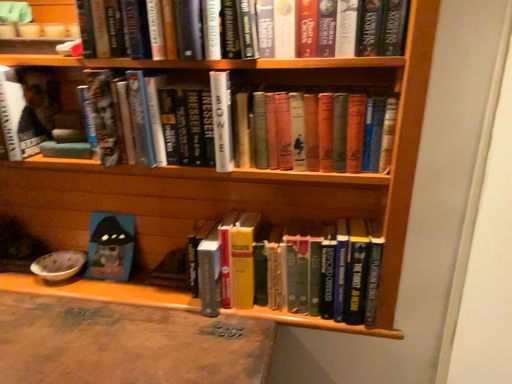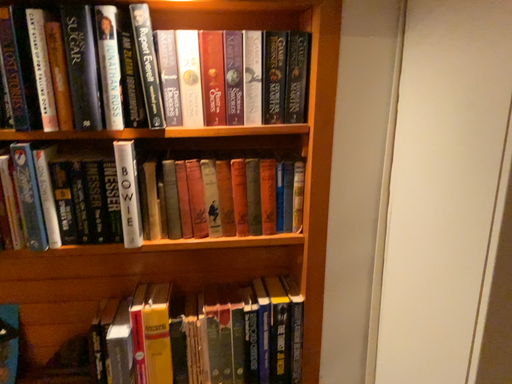
Question: Which way did the camera rotate in the video?

Choices:
 (A) rotated right
 (B) rotated left

Answer: (A)